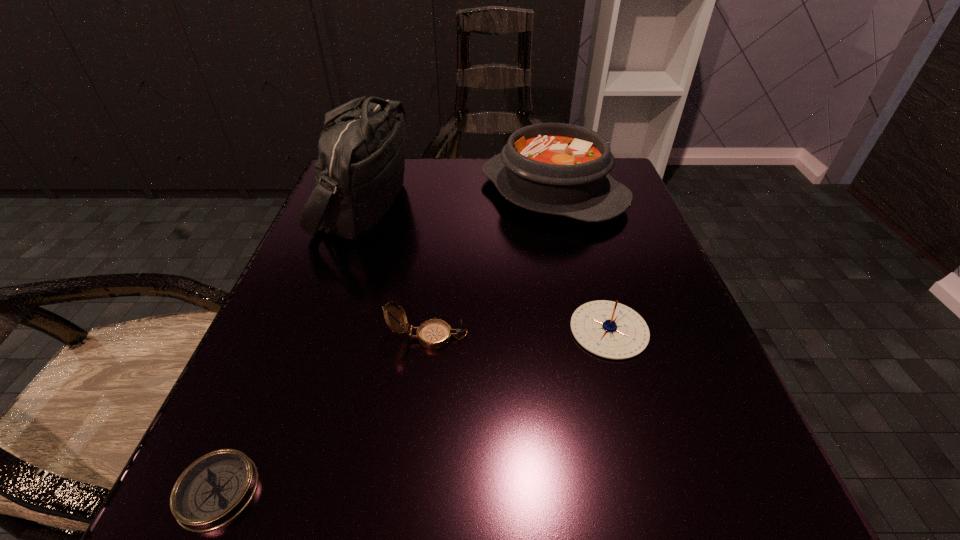
Find the location of a particular element. The height and width of the screenshot is (540, 960). free spot that satisfies the following two spatial constraints: 1. at the front padded panel of the tallest object; 2. on the left side of the rightmost compass is located at coordinates (320, 330).

Find the location of `free point that satisfies the following two spatial constraints: 1. on the front side of the rightmost compass; 2. on the face of the second compass from left to right`. free point that satisfies the following two spatial constraints: 1. on the front side of the rightmost compass; 2. on the face of the second compass from left to right is located at coordinates (611, 336).

Where is `vacant space that satisfies the following two spatial constraints: 1. on the back side of the rightmost compass; 2. at the front padded panel of the shoulder bag`? The width and height of the screenshot is (960, 540). vacant space that satisfies the following two spatial constraints: 1. on the back side of the rightmost compass; 2. at the front padded panel of the shoulder bag is located at coordinates (573, 205).